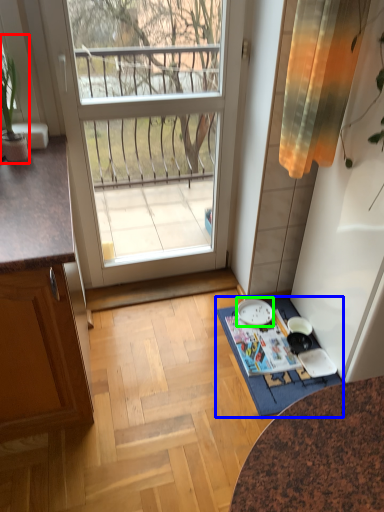
Question: Based on their relative distances, which object is nearer to houseplant (highlighted by a red box)? Choose from doormat (highlighted by a blue box) and plate (highlighted by a green box).

Choices:
 (A) doormat
 (B) plate

Answer: (A)